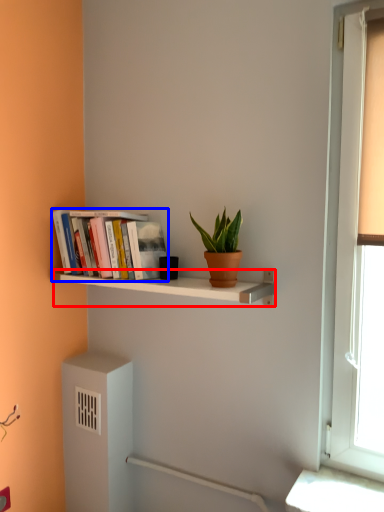
Question: Among these objects, which one is farthest to the camera, shelf (highlighted by a red box) or book (highlighted by a blue box)?

Choices:
 (A) shelf
 (B) book

Answer: (B)